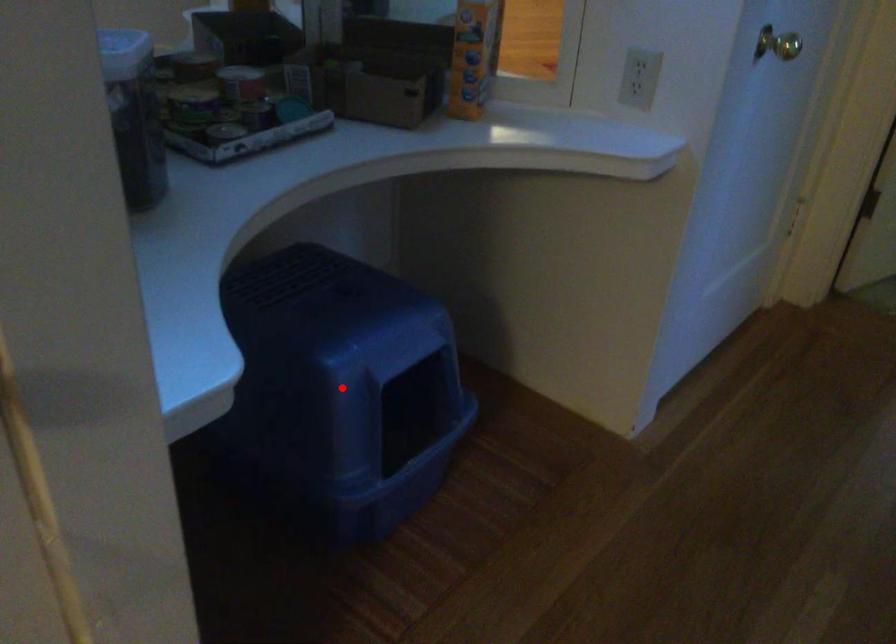
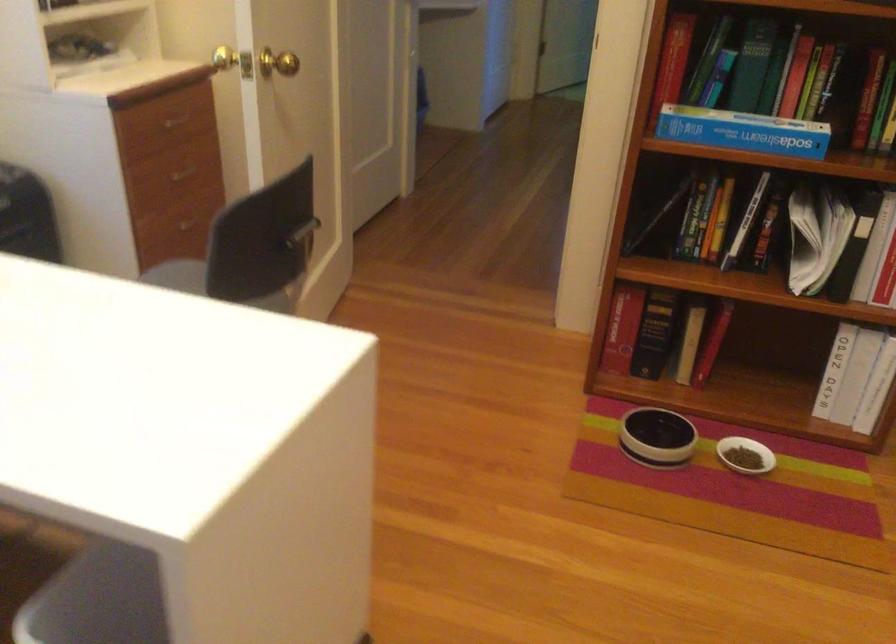
Question: I am providing you with two images of the same scene from different viewpoints. A red point is marked on the first image. Can you still see the location of the red point in image 2?

Choices:
 (A) Yes
 (B) No

Answer: (B)